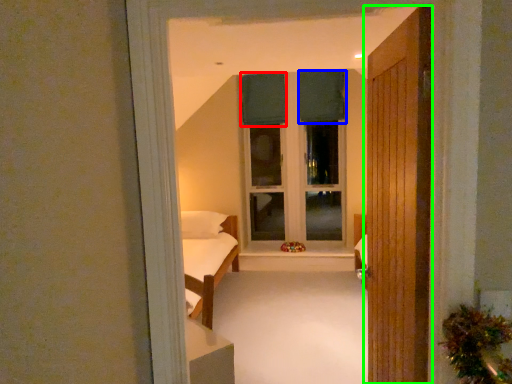
Question: Which object is the closest to the curtain (highlighted by a red box)? Choose among these: curtain (highlighted by a blue box) or door (highlighted by a green box).

Choices:
 (A) curtain
 (B) door

Answer: (A)